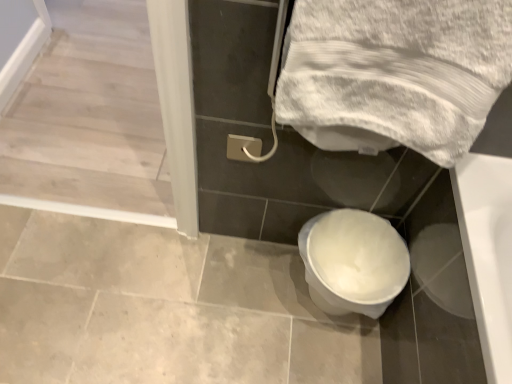
Question: Can you confirm if white glossy screen door at upper left is taller than white glossy toilet at lower center?

Choices:
 (A) no
 (B) yes

Answer: (A)

Question: Would you consider white glossy screen door at upper left to be distant from white glossy toilet at lower center?

Choices:
 (A) yes
 (B) no

Answer: (B)

Question: Is white glossy screen door at upper left in contact with white glossy toilet at lower center?

Choices:
 (A) no
 (B) yes

Answer: (A)

Question: From the image's perspective, does white glossy screen door at upper left appear lower than white glossy toilet at lower center?

Choices:
 (A) no
 (B) yes

Answer: (A)

Question: Can you confirm if white glossy screen door at upper left is wider than white glossy toilet at lower center?

Choices:
 (A) no
 (B) yes

Answer: (B)

Question: From the image's perspective, is white glossy screen door at upper left on white glossy toilet at lower center?

Choices:
 (A) no
 (B) yes

Answer: (B)

Question: Is white glossy screen door at upper left next to white textured towel at upper right?

Choices:
 (A) yes
 (B) no

Answer: (B)

Question: From a real-world perspective, is white glossy screen door at upper left over white textured towel at upper right?

Choices:
 (A) yes
 (B) no

Answer: (B)

Question: From a real-world perspective, is white glossy screen door at upper left positioned under white textured towel at upper right based on gravity?

Choices:
 (A) no
 (B) yes

Answer: (B)

Question: Can you confirm if white glossy screen door at upper left is wider than white textured towel at upper right?

Choices:
 (A) no
 (B) yes

Answer: (B)

Question: Does white glossy screen door at upper left lie behind white textured towel at upper right?

Choices:
 (A) no
 (B) yes

Answer: (B)

Question: Considering the relative positions of white glossy screen door at upper left and white textured towel at upper right in the image provided, is white glossy screen door at upper left in front of white textured towel at upper right?

Choices:
 (A) yes
 (B) no

Answer: (B)

Question: Considering the relative sizes of white glossy toilet at lower center and white glossy screen door at upper left in the image provided, is white glossy toilet at lower center smaller than white glossy screen door at upper left?

Choices:
 (A) yes
 (B) no

Answer: (A)